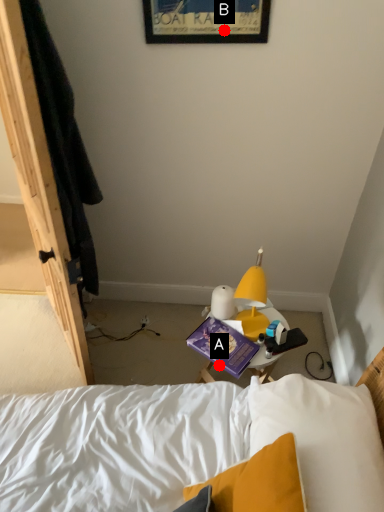
Question: Two points are circled on the image, labeled by A and B beside each circle. Which point is further to the camera?

Choices:
 (A) A is further
 (B) B is further

Answer: (A)